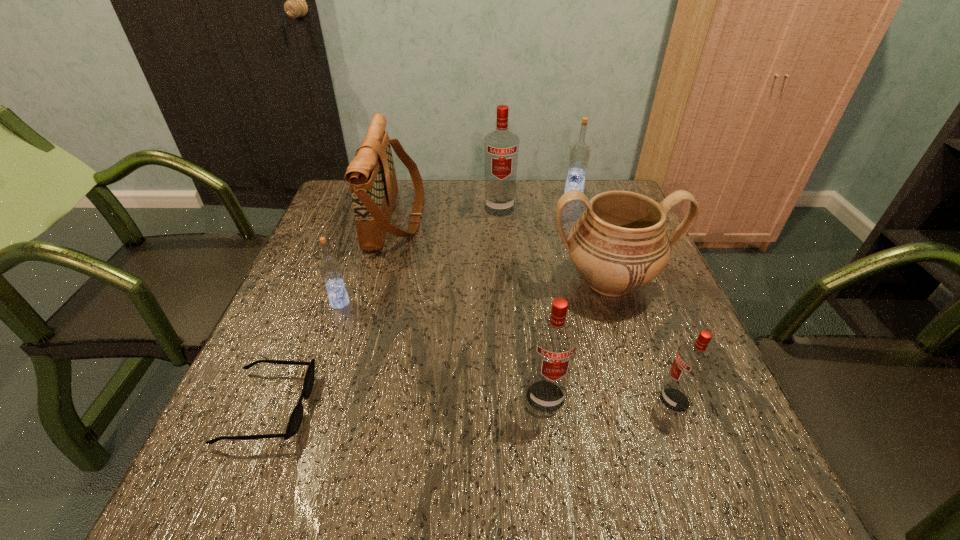
The width and height of the screenshot is (960, 540). Find the location of `empty space that is in between the second smallest red vodka and the shortest object`. empty space that is in between the second smallest red vodka and the shortest object is located at coordinates (407, 402).

The width and height of the screenshot is (960, 540). I want to click on vacant space that's between the farther blue vodka and the rightmost red vodka, so click(624, 298).

Identify the location of unoccupied area between the shoulder bag and the shortest object. (332, 313).

You are a GUI agent. You are given a task and a screenshot of the screen. Output one action in this format:
    pyautogui.click(x=<x>, y=<y>)
    Task: Click on the vacant area that lies between the third farthest vodka and the urn
    
    Given the screenshot: What is the action you would take?
    pyautogui.click(x=474, y=292)

Find the location of a particular element. Image resolution: width=960 pixels, height=540 pixels. vacant region between the sunglasses and the urn is located at coordinates (439, 344).

Find the location of `free space between the rightmost red vodka and the leftmost vodka`. free space between the rightmost red vodka and the leftmost vodka is located at coordinates (507, 352).

Find the location of a particular element. The image size is (960, 540). the second closest object to the right blue vodka is located at coordinates (619, 244).

The image size is (960, 540). Identify the location of object identified as the closest to the shoulder bag. (330, 268).

At what (x,y) coordinates should I click in order to perform the action: click on vodka object that ranks as the second closest to the leftmost vodka. Please return your answer as a coordinate pair (x, y). Looking at the image, I should click on (501, 147).

Find the location of a particular element. The image size is (960, 540). vodka that stands as the closest to the biggest red vodka is located at coordinates (579, 154).